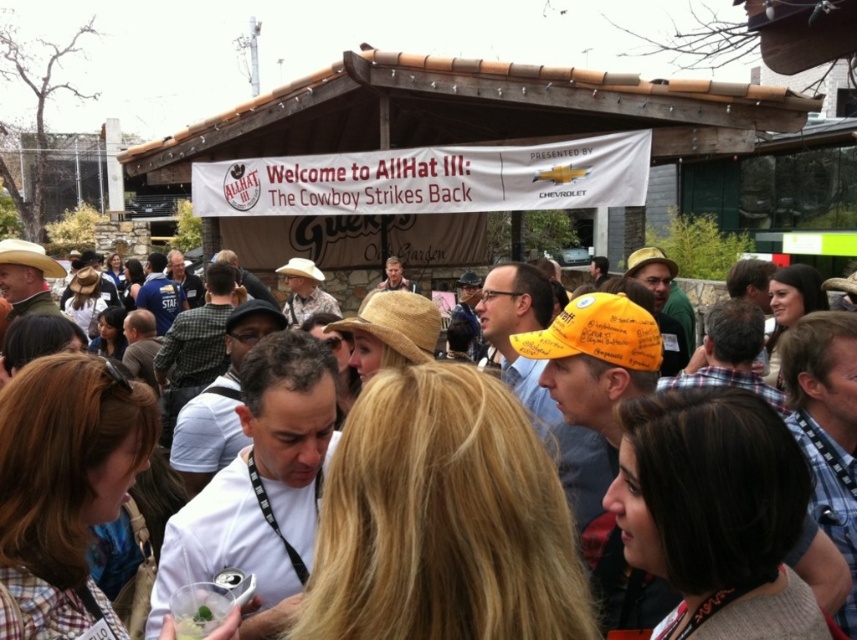
Question: Is natural straw cowboy hat at center further to camera compared to brown straw hat at center?

Choices:
 (A) yes
 (B) no

Answer: (A)

Question: Which point is closer to the camera taking this photo?

Choices:
 (A) (838, 580)
 (B) (387, 336)

Answer: (A)

Question: Among these points, which one is farthest from the camera?

Choices:
 (A) (598, 465)
 (B) (393, 294)

Answer: (B)

Question: Does natural straw cowboy hat at center lie in front of brown straw hat at center?

Choices:
 (A) no
 (B) yes

Answer: (A)

Question: Is natural straw cowboy hat at center to the left of brown straw hat at center from the viewer's perspective?

Choices:
 (A) yes
 (B) no

Answer: (B)